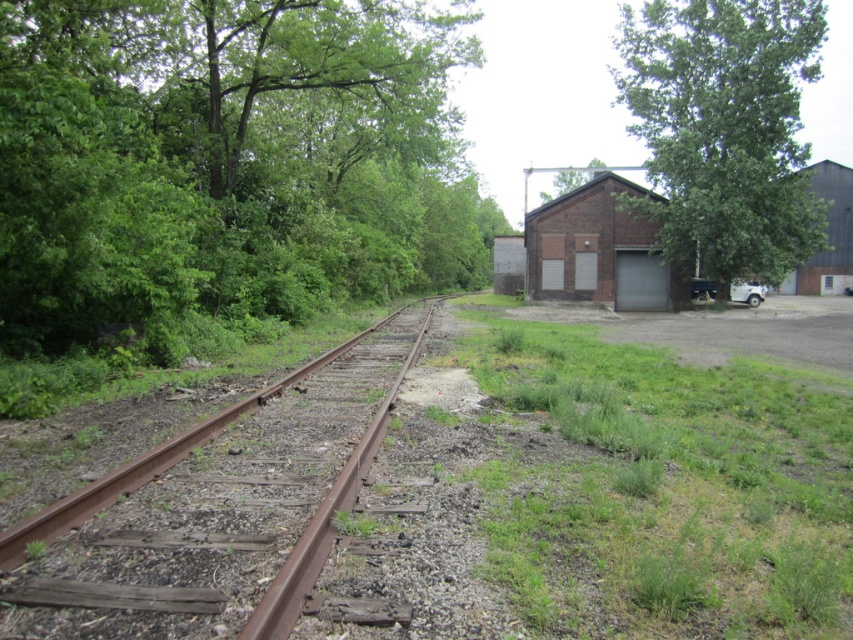
Question: Considering the real-world distances, which object is closest to the green grass at lower right?

Choices:
 (A) green leafy tree at center-right
 (B) green leafy tree at left

Answer: (B)

Question: Which object is closer to the camera taking this photo?

Choices:
 (A) green leafy tree at center-right
 (B) rusty metal train track at left

Answer: (B)

Question: Does green grass at lower right have a larger size compared to rusty metal train track at left?

Choices:
 (A) yes
 (B) no

Answer: (A)

Question: Is green leafy tree at left further to camera compared to green leafy tree at center-right?

Choices:
 (A) no
 (B) yes

Answer: (A)

Question: Which point is farther to the camera?

Choices:
 (A) green leafy tree at left
 (B) green grass at lower right
 (C) green leafy tree at center-right
 (D) rusty metal train track at left

Answer: (C)

Question: Can you confirm if green leafy tree at left is positioned below green leafy tree at center-right?

Choices:
 (A) yes
 (B) no

Answer: (A)